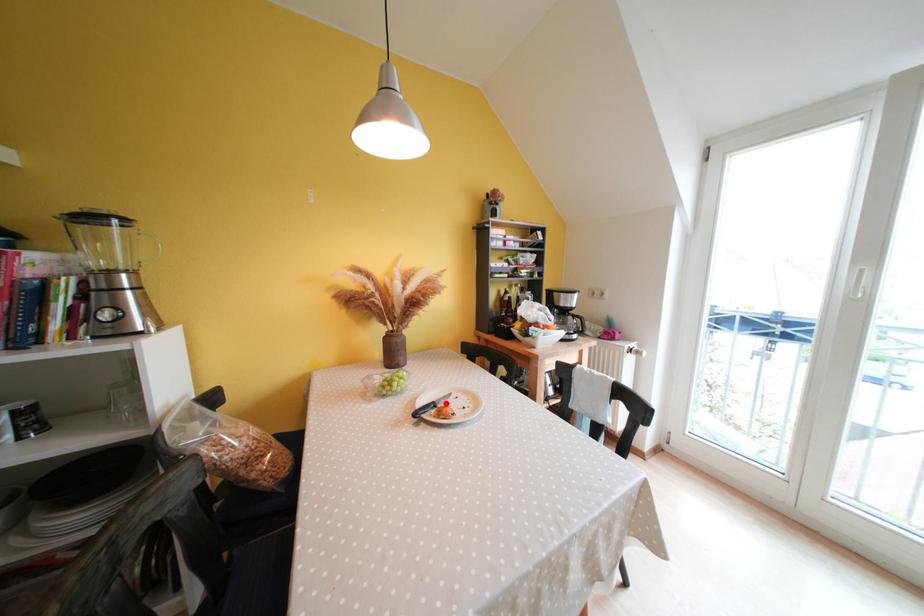
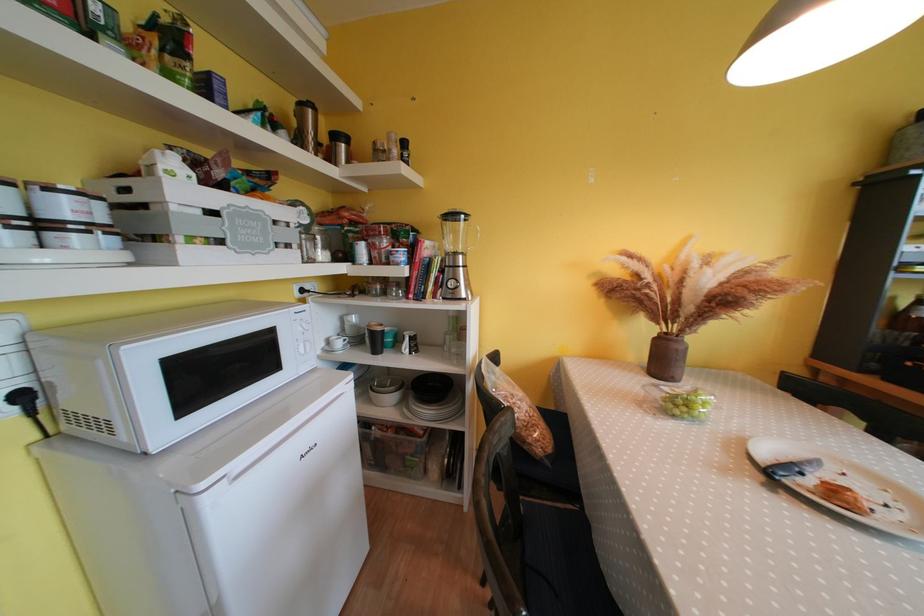
In the second image, find the point that corresponds to the highlighted location in the first image.

(808, 467)